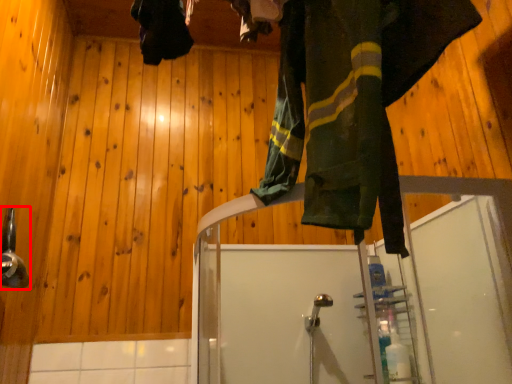
Question: Observing the image, what is the correct spatial positioning of shower (annotated by the red box) in reference to clothing?

Choices:
 (A) left
 (B) right

Answer: (A)